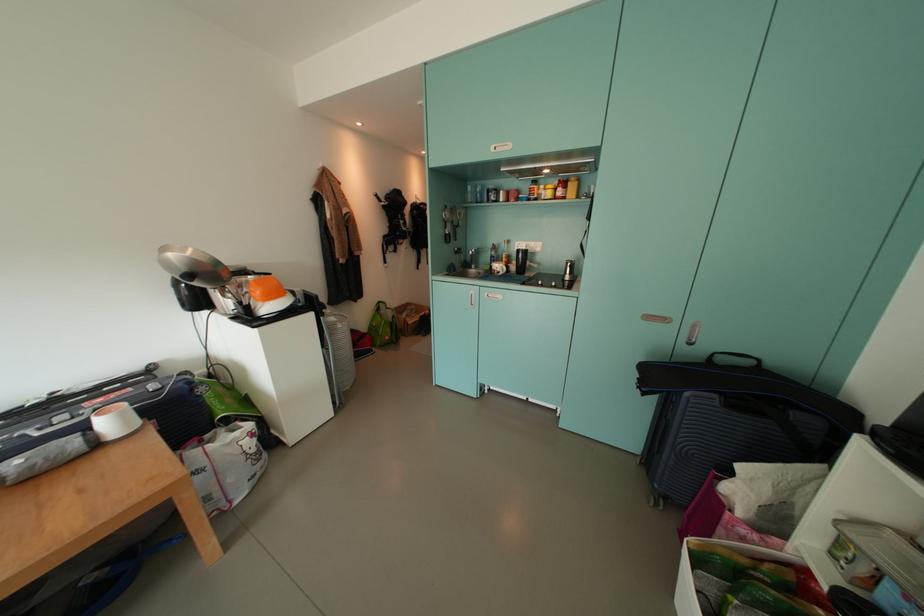
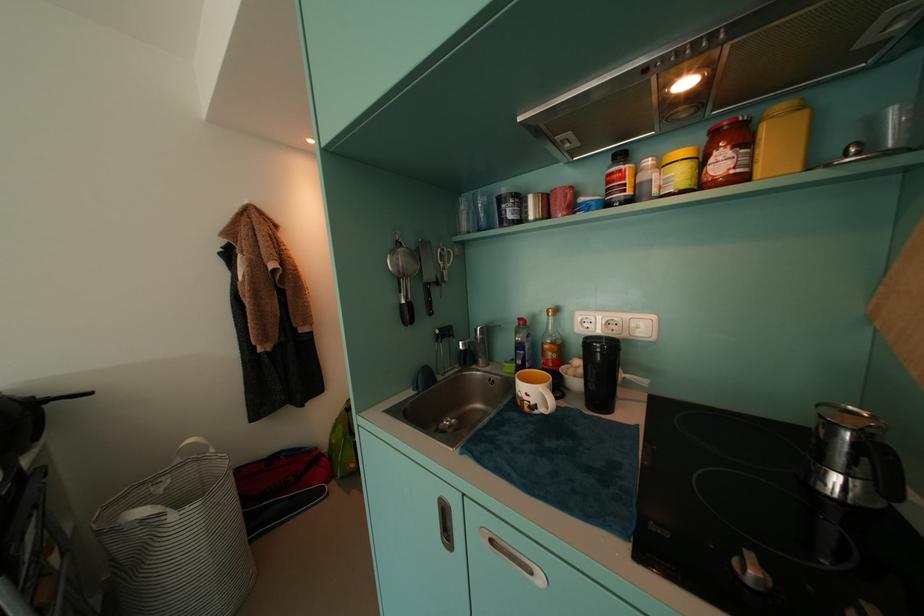
Locate, in the second image, the point that corresponds to (566,195) in the first image.

(730, 166)